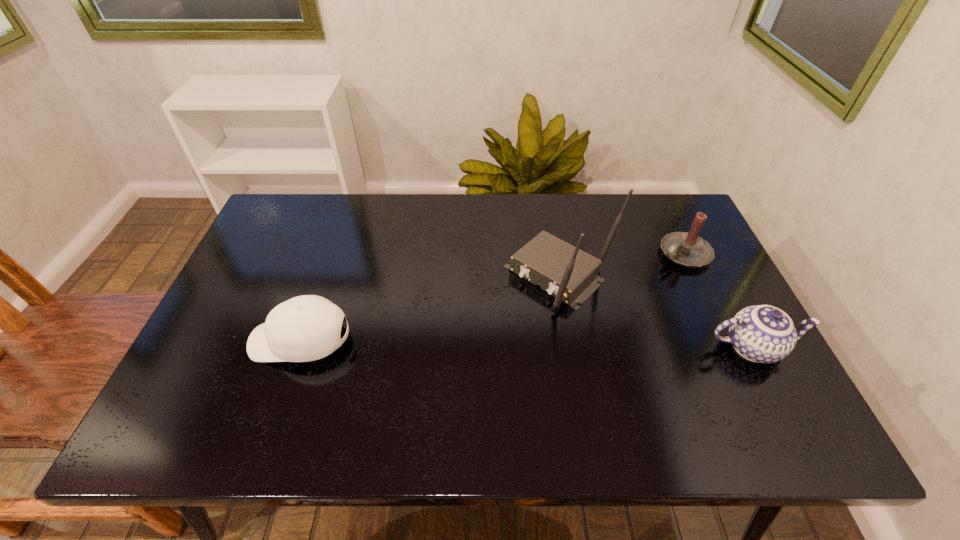
Find the location of a particular element. vacant space located 0.400m on the side of the candle with the handle loop is located at coordinates (560, 323).

Where is `vacant space located on the back of the tallest object to connect cables`? The image size is (960, 540). vacant space located on the back of the tallest object to connect cables is located at coordinates (506, 325).

Locate an element on the screen. The height and width of the screenshot is (540, 960). free space located on the back of the tallest object to connect cables is located at coordinates (491, 340).

Locate an element on the screen. The height and width of the screenshot is (540, 960). vacant space located 0.270m on the back of the tallest object to connect cables is located at coordinates (454, 374).

Find the location of a particular element. Image resolution: width=960 pixels, height=540 pixels. object at the far edge is located at coordinates (688, 249).

The width and height of the screenshot is (960, 540). I want to click on baseball cap that is at the near edge, so click(x=305, y=328).

Locate an element on the screen. Image resolution: width=960 pixels, height=540 pixels. chinaware located in the near edge section of the desktop is located at coordinates (761, 333).

Find the location of a particular element. This screenshot has width=960, height=540. object positioned at the left edge is located at coordinates (305, 328).

You are a GUI agent. You are given a task and a screenshot of the screen. Output one action in this format:
    pyautogui.click(x=<x>, y=<y>)
    Task: Click on the chinaware at the right edge
    The image size is (960, 540).
    Given the screenshot: What is the action you would take?
    click(761, 333)

Image resolution: width=960 pixels, height=540 pixels. I want to click on candle at the right edge, so click(x=688, y=249).